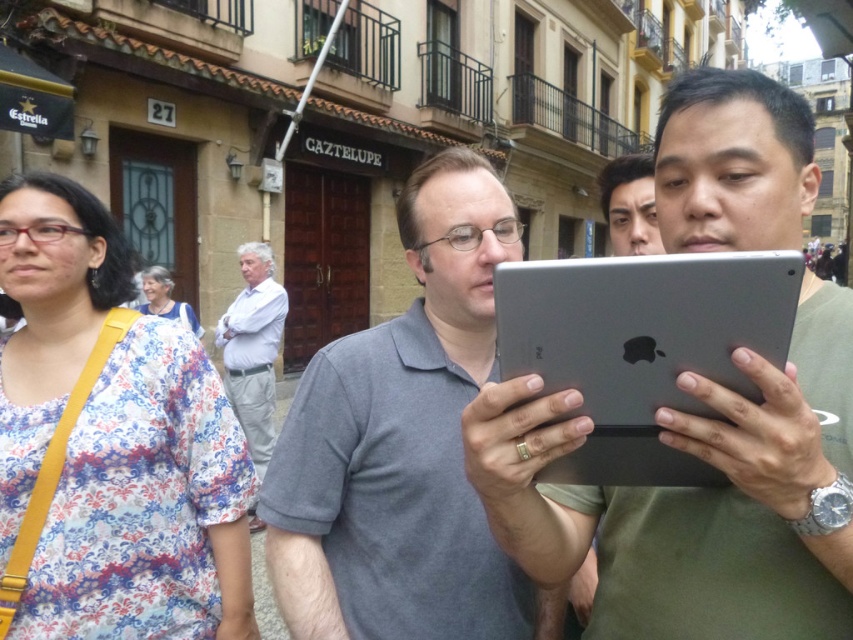
Question: Which is nearer to the white cotton shirt at center?

Choices:
 (A) satin silver tablet at center
 (B) floral fabric blouse at left
 (C) matte gray tablet at center

Answer: (B)

Question: Which of these objects is positioned farthest from the floral fabric blouse at left?

Choices:
 (A) floral fabric dress at upper left
 (B) matte black face at upper center

Answer: (A)

Question: Is matte gray tablet at center further to the viewer compared to floral fabric dress at upper left?

Choices:
 (A) yes
 (B) no

Answer: (B)

Question: Which object is farther from the camera taking this photo?

Choices:
 (A) matte black face at upper center
 (B) floral fabric blouse at left
 (C) matte gray tablet at center
 (D) white cotton shirt at center

Answer: (D)

Question: Is satin silver tablet at center further to the viewer compared to matte black face at upper center?

Choices:
 (A) yes
 (B) no

Answer: (B)

Question: Does satin silver tablet at center appear on the left side of white cotton shirt at center?

Choices:
 (A) yes
 (B) no

Answer: (B)